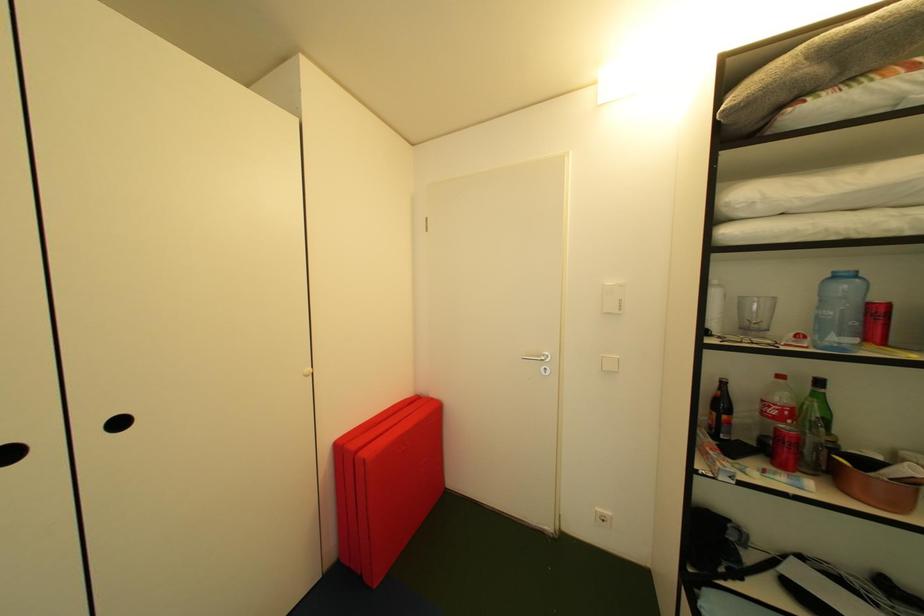
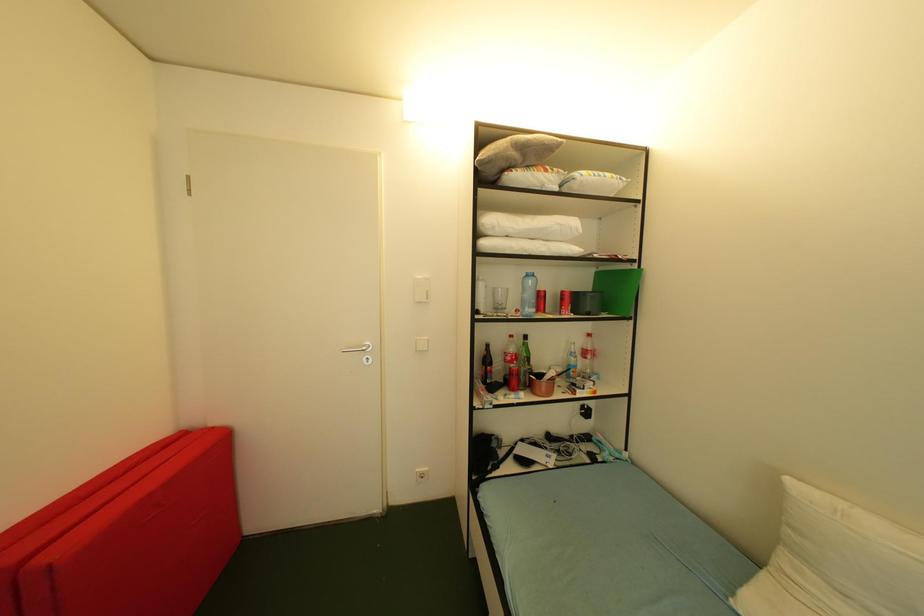
Question: How did the camera likely rotate?

Choices:
 (A) Left
 (B) Right
 (C) Up
 (D) Down

Answer: (B)